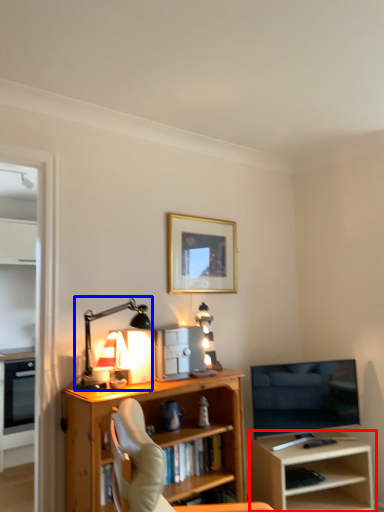
Question: Which of the following is the closest to the observer, shelf (highlighted by a red box) or table lamp (highlighted by a blue box)?

Choices:
 (A) shelf
 (B) table lamp

Answer: (B)